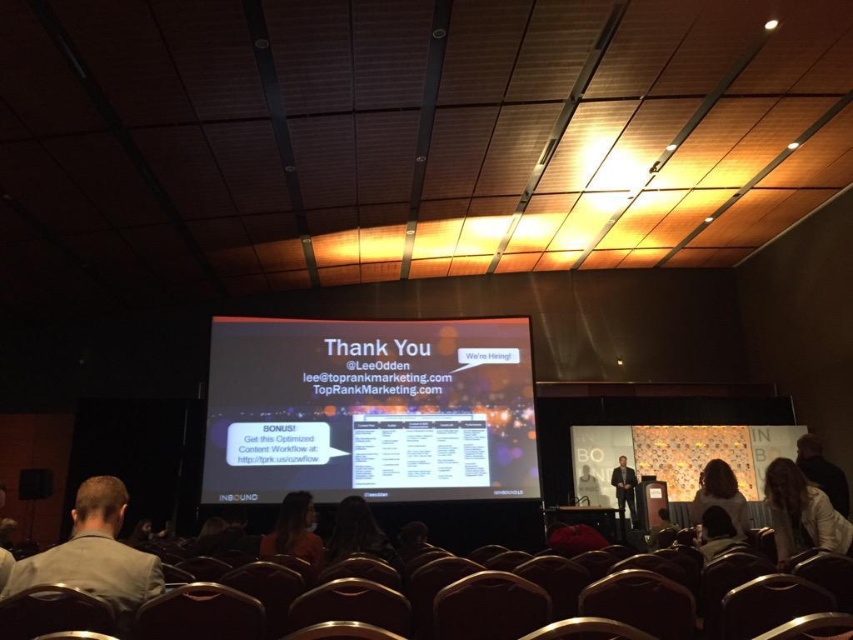
Between dark brown leather chair at lower right and matte black suit at center, which one appears on the left side from the viewer's perspective?

Positioned to the left is dark brown leather chair at lower right.

Can you confirm if dark brown leather chair at lower right is positioned below matte black suit at center?

Incorrect, dark brown leather chair at lower right is not positioned below matte black suit at center.

The width and height of the screenshot is (853, 640). Describe the element at coordinates (720, 496) in the screenshot. I see `dark brown leather chair at lower right` at that location.

Locate an element on the screen. The width and height of the screenshot is (853, 640). dark brown leather chair at lower right is located at coordinates (720, 496).

Is point (354, 522) closer to camera compared to point (712, 492)?

That is True.

Does matte black hair at center have a greater height compared to dark brown leather chair at lower right?

No.

Which is in front, point (355, 496) or point (728, 500)?

Point (728, 500) is more forward.

Where is `matte black hair at center`? matte black hair at center is located at coordinates (357, 532).

The height and width of the screenshot is (640, 853). What do you see at coordinates (369, 410) in the screenshot?
I see `white matte projector screen at center` at bounding box center [369, 410].

Can you confirm if white matte projector screen at center is positioned to the left of matte black suit at center?

Yes, white matte projector screen at center is to the left of matte black suit at center.

I want to click on white matte projector screen at center, so click(x=369, y=410).